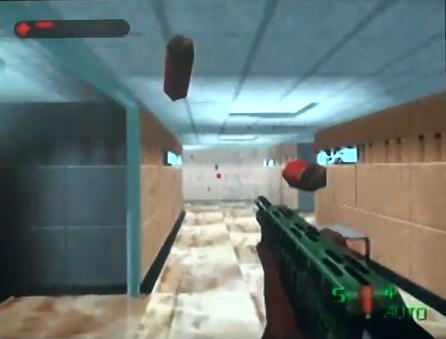
This screenshot has width=446, height=339. Find the location of `windows`. windows is located at coordinates (344, 151), (170, 159).